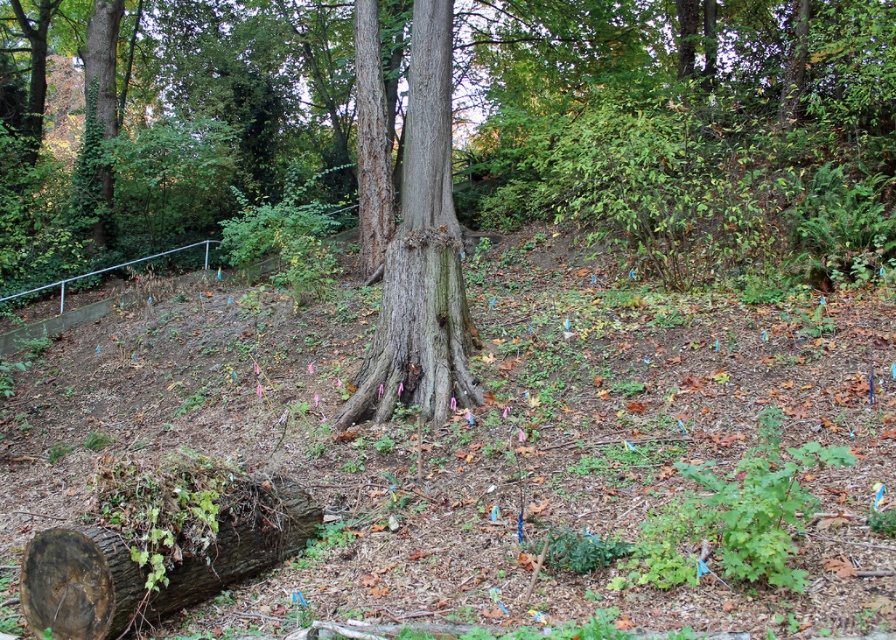
You are a hiker who needs to determine which object is taller between the smooth brown tree trunk at center and the brown rough log at lower left. Based on the scene, which one is taller?

The smooth brown tree trunk at center is much taller than the brown rough log at lower left.

You are a hiker navigating through the forest and see two flags marked as point (448, 129) and point (76, 620). Which flag is closer to you?

Point (448, 129) is further to the viewer than point (76, 620), so the flag at point (76, 620) is closer to you.

You are a hiker who wants to place a backpack on the ground near the smooth brown tree trunk at center and the brown rough log at lower left. Which object should you place it closer to if you want it to be on higher ground?

The smooth brown tree trunk at center is positioned over the brown rough log at lower left, so placing the backpack near the smooth brown tree trunk at center would be on higher ground.